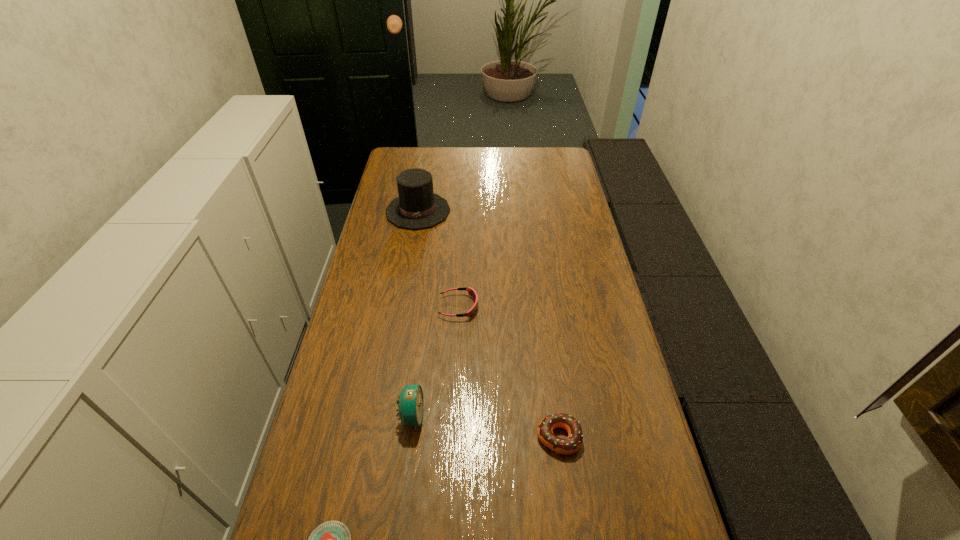
Find the location of a particular element. The width and height of the screenshot is (960, 540). vacant space at the far edge of the desktop is located at coordinates (477, 150).

You are a GUI agent. You are given a task and a screenshot of the screen. Output one action in this format:
    pyautogui.click(x=<x>, y=<y>)
    Task: Click on the free space at the left edge
    
    Given the screenshot: What is the action you would take?
    pyautogui.click(x=375, y=326)

Identify the location of vacant space at the right edge of the desktop. This screenshot has width=960, height=540. (582, 241).

This screenshot has height=540, width=960. What are the coordinates of `free region at the far right corner of the desktop` in the screenshot? It's located at (552, 173).

This screenshot has width=960, height=540. In order to click on free area in between the dress hat and the goggles in this screenshot , I will do `click(439, 259)`.

This screenshot has height=540, width=960. In order to click on unoccupied position between the farthest object and the fourth shortest object in this screenshot , I will do `click(415, 313)`.

This screenshot has width=960, height=540. What are the coordinates of `vacant space in between the dress hat and the doughnut` in the screenshot? It's located at (489, 324).

Locate an element on the screen. This screenshot has width=960, height=540. free space that is in between the alarm clock and the dress hat is located at coordinates (415, 313).

You are a GUI agent. You are given a task and a screenshot of the screen. Output one action in this format:
    pyautogui.click(x=<x>, y=<y>)
    Task: Click on the free space between the fourth nearest object and the doughnut
    The width and height of the screenshot is (960, 540).
    Given the screenshot: What is the action you would take?
    pyautogui.click(x=509, y=372)

Where is `free space between the doughnut and the fourth shortest object`? The image size is (960, 540). free space between the doughnut and the fourth shortest object is located at coordinates (485, 427).